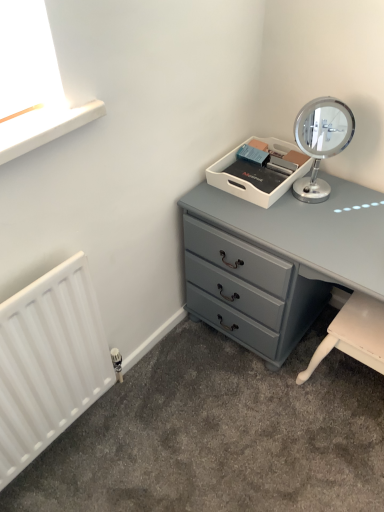
Find the location of a particular element. The image size is (384, 512). vacant space underneath white matte radiator at lower left (from a real-world perspective) is located at coordinates click(x=67, y=441).